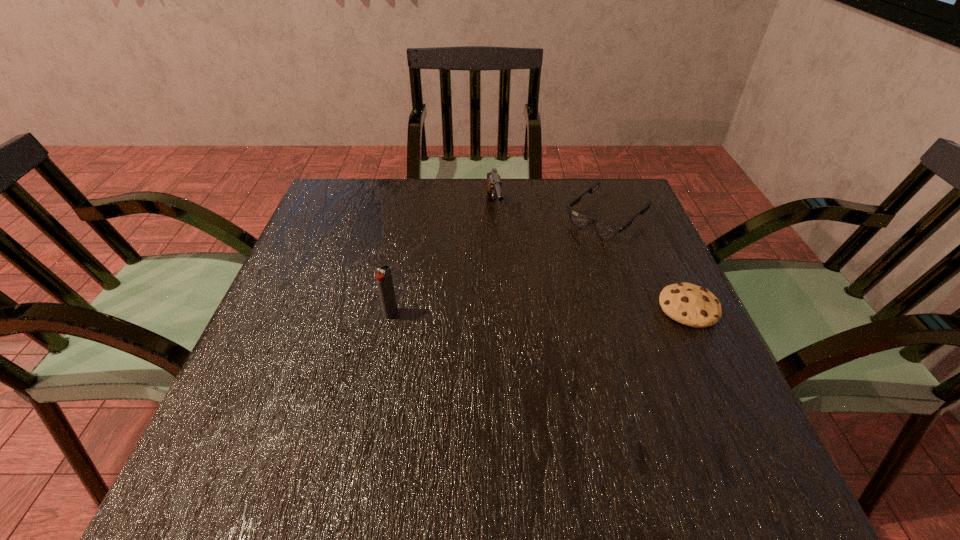
The height and width of the screenshot is (540, 960). I want to click on free space on the desktop that is between the leftmost object and the cookie and is positioned on the temples of the sunglasses, so click(x=496, y=312).

You are a GUI agent. You are given a task and a screenshot of the screen. Output one action in this format:
    pyautogui.click(x=<x>, y=<y>)
    Task: Click on the vacant space on the desktop that is between the leftmost object and the cookie and is positioned at the barrel of the pistol
    
    Given the screenshot: What is the action you would take?
    click(x=517, y=311)